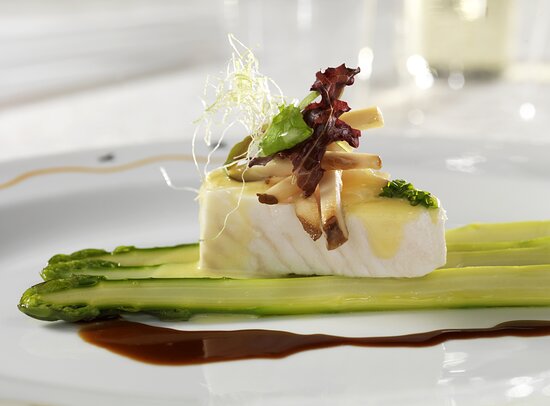
This screenshot has width=550, height=406. I want to click on wall, so click(x=128, y=56).